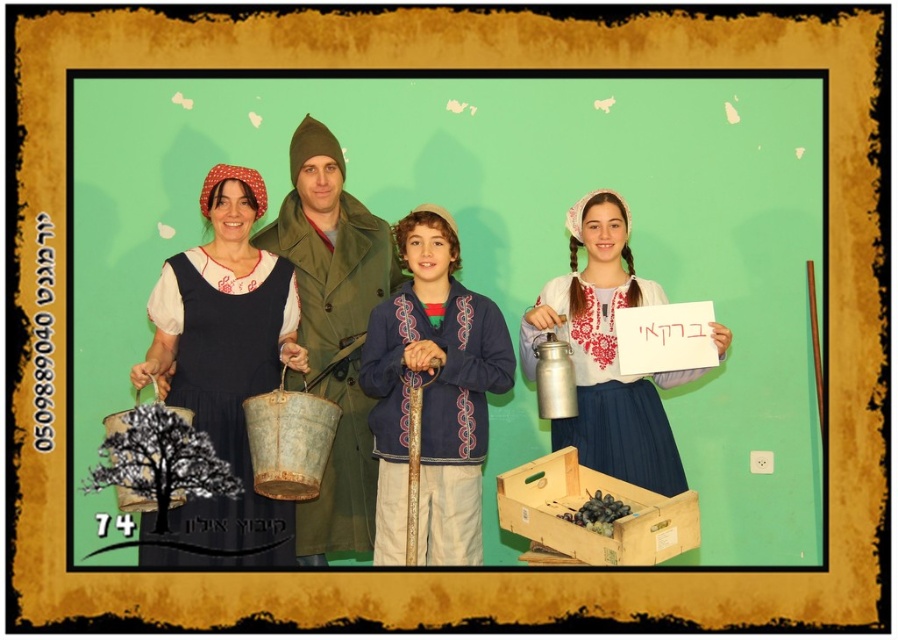
Between green fabric coat at center and blue embroidered jacket at center, which one has less height?

Standing shorter between the two is blue embroidered jacket at center.

In the scene shown: Is green fabric coat at center positioned behind blue embroidered jacket at center?

Yes, it is.

Does point (386, 228) lie behind point (395, 358)?

Yes.

Locate an element on the screen. This screenshot has width=898, height=640. green fabric coat at center is located at coordinates (333, 330).

Is point (227, 291) behind point (253, 236)?

That is False.

Does matte blue dress at left have a smaller size compared to green fabric coat at center?

Incorrect, matte blue dress at left is not smaller in size than green fabric coat at center.

Does point (174, 296) come closer to viewer compared to point (376, 476)?

Yes, it is in front of point (376, 476).

You are a GUI agent. You are given a task and a screenshot of the screen. Output one action in this format:
    pyautogui.click(x=<x>, y=<y>)
    Task: Click on the matte blue dress at left
    
    Given the screenshot: What is the action you would take?
    pyautogui.click(x=222, y=372)

Is metal bucket at center thinner than green fabric coat at center?

No, metal bucket at center is not thinner than green fabric coat at center.

At what (x,y) coordinates should I click in order to perform the action: click on metal bucket at center. Please return your answer as a coordinate pair (x, y). The width and height of the screenshot is (898, 640). Looking at the image, I should click on (330, 323).

In order to click on metal bucket at center in this screenshot , I will do `click(330, 323)`.